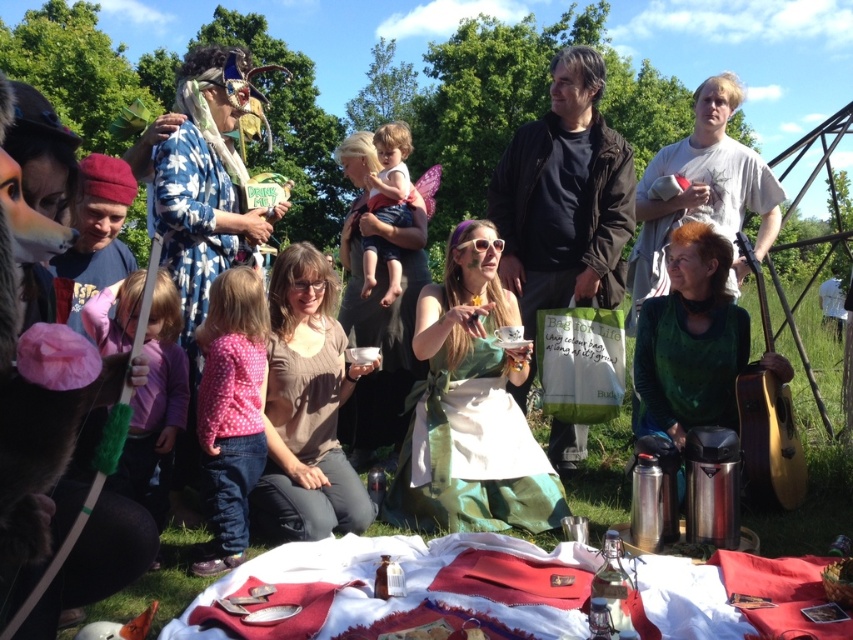
You are a photographer at the picnic and want to capture a group photo. The green satin dress at center and the pink dotted shirt at lower left are both in the frame. Which clothing item might require more space in the photo to avoid being cut off?

The green satin dress at center might require more space in the photo to avoid being cut off since it is wider than the pink dotted shirt at lower left.

Consider the image. You are attending a picnic and want to sit between the green satin dress at center and the green velvet dress at center. Which dress should you sit closer to if you want to have more space around you?

You should sit closer to the green satin dress at center because it might be wider than the green velvet dress at center, providing more space around it.

You are a photographer at the picnic and want to ensure both the green satin dress at center and the pink dotted shirt at lower left are visible in your photo. Which clothing item should you focus on to ensure both are in frame?

The green satin dress at center is much taller than the pink dotted shirt at lower left, so focusing on the green satin dress at center will ensure both are visible in the photo.